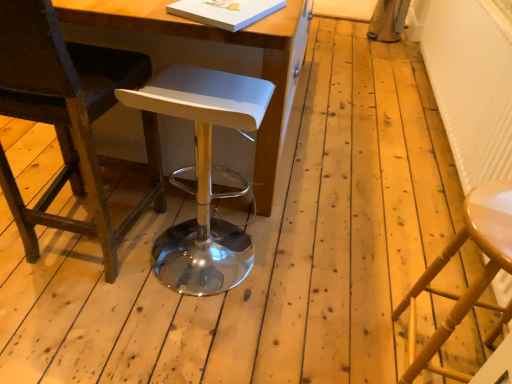
Question: Does dark brown leather chair at left have a larger size compared to wooden table at center?

Choices:
 (A) no
 (B) yes

Answer: (A)

Question: Would you consider dark brown leather chair at left to be distant from wooden table at center?

Choices:
 (A) yes
 (B) no

Answer: (B)

Question: Is dark brown leather chair at left thinner than wooden table at center?

Choices:
 (A) no
 (B) yes

Answer: (B)

Question: Is dark brown leather chair at left to the left of wooden table at center from the viewer's perspective?

Choices:
 (A) no
 (B) yes

Answer: (B)

Question: From the image's perspective, would you say dark brown leather chair at left is shown under wooden table at center?

Choices:
 (A) yes
 (B) no

Answer: (A)

Question: Can you confirm if dark brown leather chair at left is wider than wooden table at center?

Choices:
 (A) no
 (B) yes

Answer: (A)

Question: Does dark brown leather chair at left have a lesser height compared to wooden chair at right, positioned as the second stool in left-to-right order?

Choices:
 (A) yes
 (B) no

Answer: (B)

Question: Does dark brown leather chair at left appear on the right side of wooden chair at right, positioned as the second stool in left-to-right order?

Choices:
 (A) yes
 (B) no

Answer: (B)

Question: Is dark brown leather chair at left with wooden chair at right, the first stool when ordered from right to left?

Choices:
 (A) no
 (B) yes

Answer: (A)

Question: Can you confirm if dark brown leather chair at left is thinner than wooden chair at right, the first stool when ordered from right to left?

Choices:
 (A) no
 (B) yes

Answer: (A)

Question: Would you say dark brown leather chair at left is outside wooden chair at right, the first stool when ordered from right to left?

Choices:
 (A) yes
 (B) no

Answer: (A)

Question: Considering the relative positions of dark brown leather chair at left and wooden chair at right, the first stool when ordered from right to left, in the image provided, is dark brown leather chair at left to the left of wooden chair at right, the first stool when ordered from right to left, from the viewer's perspective?

Choices:
 (A) yes
 (B) no

Answer: (A)

Question: Does white textured radiator at right appear on the left side of white plastic stool at center, acting as the second stool starting from the right?

Choices:
 (A) yes
 (B) no

Answer: (B)